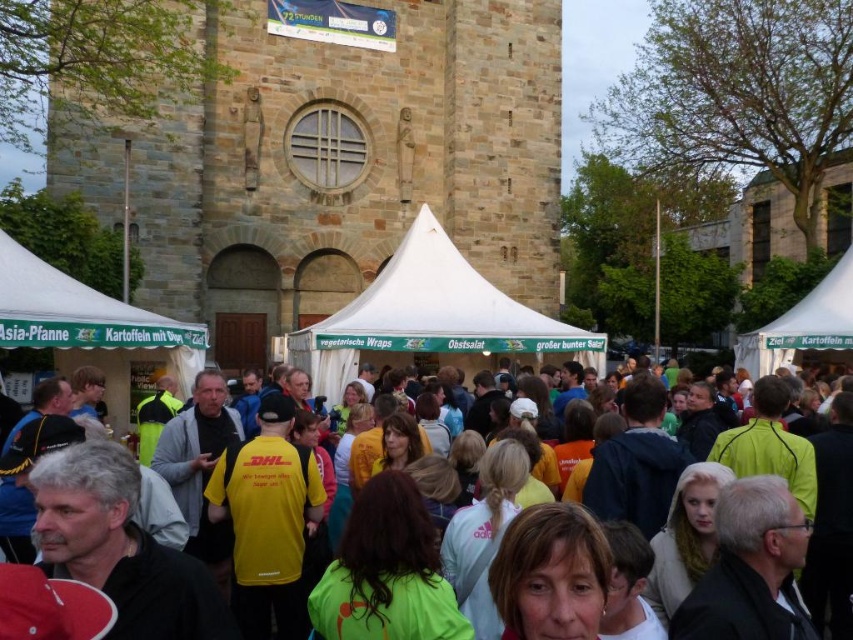
Is yellow athletic shirt at center wider than white canvas tent at center?

Yes, yellow athletic shirt at center is wider than white canvas tent at center.

Measure the distance between point (12, 410) and camera.

Point (12, 410) and camera are 178.37 feet apart.

The height and width of the screenshot is (640, 853). In order to click on yellow athletic shirt at center in this screenshot , I will do `click(189, 474)`.

Which is below, brown stone church at center or yellow athletic shirt at center?

yellow athletic shirt at center is lower down.

Between brown stone church at center and yellow athletic shirt at center, which one is positioned higher?

brown stone church at center is higher up.

What do you see at coordinates (337, 161) in the screenshot? The height and width of the screenshot is (640, 853). I see `brown stone church at center` at bounding box center [337, 161].

Find the location of a particular element. This screenshot has width=853, height=640. brown stone church at center is located at coordinates 337,161.

Does brown stone church at center have a larger size compared to white canvas tent at center?

Correct, brown stone church at center is larger in size than white canvas tent at center.

Identify the location of brown stone church at center. The width and height of the screenshot is (853, 640). (337, 161).

Locate an element on the screen. brown stone church at center is located at coordinates (337, 161).